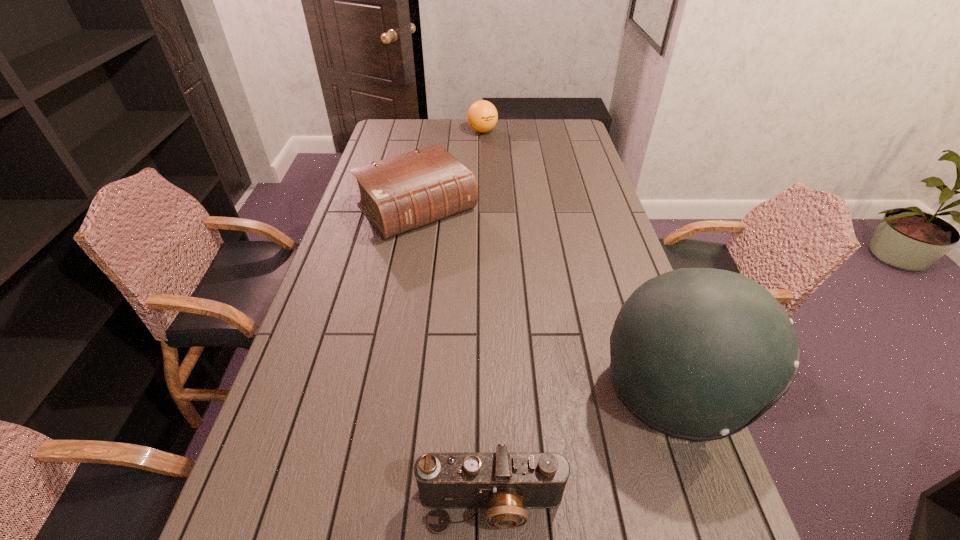
Identify the location of blank space located on the spine side of the third nearest object. The image size is (960, 540). (481, 278).

This screenshot has width=960, height=540. What are the coordinates of `object that is positioned at the far edge` in the screenshot? It's located at (482, 116).

Locate an element on the screen. object that is positioned at the near edge is located at coordinates click(x=505, y=483).

This screenshot has width=960, height=540. Find the location of `object present at the left edge`. object present at the left edge is located at coordinates (399, 194).

Identify the location of object that is at the right edge. This screenshot has width=960, height=540. (698, 354).

I want to click on blank space at the far edge of the desktop, so click(x=447, y=128).

In the image, there is a desktop. In order to click on vacant space at the left edge in this screenshot , I will do `click(339, 241)`.

The image size is (960, 540). I want to click on blank space at the right edge of the desktop, so click(604, 220).

The width and height of the screenshot is (960, 540). In the image, there is a desktop. In order to click on vacant space at the far right corner in this screenshot , I will do `click(583, 134)`.

The height and width of the screenshot is (540, 960). In the image, there is a desktop. What are the coordinates of `vacant area at the near right corner` in the screenshot? It's located at (635, 470).